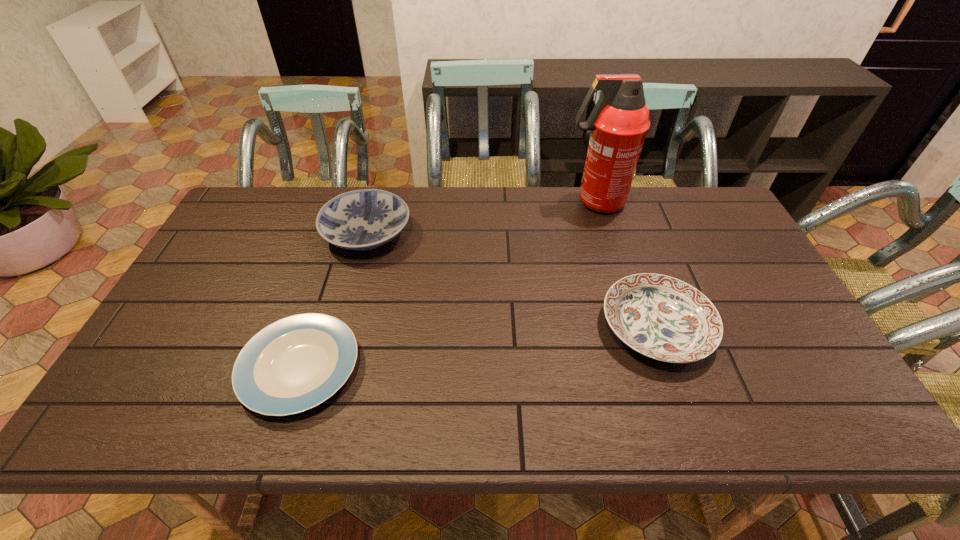
Locate an element on the screen. The height and width of the screenshot is (540, 960). the second closest object to the farthest plate is located at coordinates (619, 122).

Where is `object that can be found as the closest to the shortest object`? The image size is (960, 540). object that can be found as the closest to the shortest object is located at coordinates (365, 219).

Select which plate is the closest to the shortest object. Please provide its 2D coordinates. Your answer should be formatted as a tuple, i.e. [(x, y)], where the tuple contains the x and y coordinates of a point satisfying the conditions above.

[(365, 219)]

This screenshot has width=960, height=540. Identify the location of plate that can be found as the second closest to the shortest object. (661, 317).

Identify the location of vacant space that satisfies the following two spatial constraints: 1. on the back side of the second shortest plate; 2. on the trigger side of the fire extinguisher. (613, 202).

Locate an element on the screen. The image size is (960, 540). vacant space that satisfies the following two spatial constraints: 1. on the trigger side of the fire extinguisher; 2. on the back side of the second shortest object is located at coordinates (633, 326).

Where is `vacant region that satisfies the following two spatial constraints: 1. on the trigger side of the tallest object; 2. on the back side of the third tallest object`? vacant region that satisfies the following two spatial constraints: 1. on the trigger side of the tallest object; 2. on the back side of the third tallest object is located at coordinates pos(633,326).

What are the coordinates of `free point that satisfies the following two spatial constraints: 1. on the trigger side of the rightmost plate; 2. on the left side of the fire extinguisher` in the screenshot? It's located at (633, 326).

Locate an element on the screen. The image size is (960, 540). vacant position in the image that satisfies the following two spatial constraints: 1. on the trigger side of the fire extinguisher; 2. on the right side of the second shortest object is located at coordinates (633, 326).